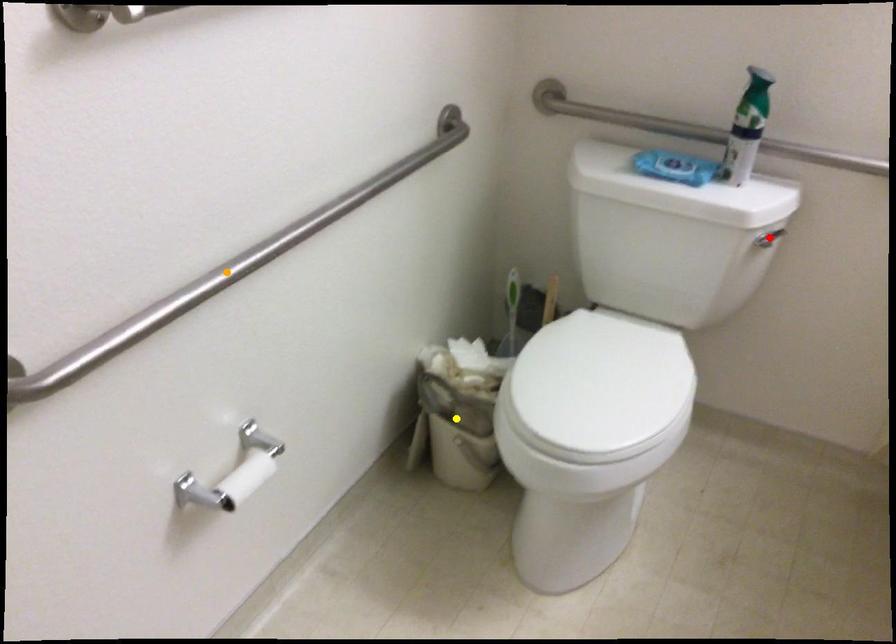
Order these from nearest to farthest:
- yellow point
- orange point
- red point

orange point
red point
yellow point